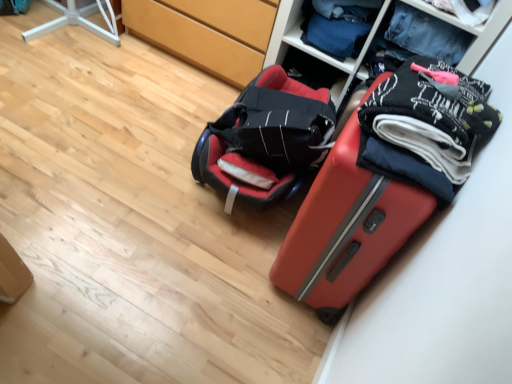
Question: Can you confirm if matte black bag at center is smaller than denim jeans at upper right, which ranks as the second clothing in bottom-to-top order?

Choices:
 (A) no
 (B) yes

Answer: (A)

Question: Is matte black bag at center positioned in front of denim jeans at upper right, which ranks as the second clothing in bottom-to-top order?

Choices:
 (A) no
 (B) yes

Answer: (B)

Question: From the image's perspective, is matte black bag at center below denim jeans at upper right, which ranks as the second clothing in bottom-to-top order?

Choices:
 (A) yes
 (B) no

Answer: (A)

Question: From a real-world perspective, is matte black bag at center over denim jeans at upper right, placed as the 1th clothing when sorted from back to front?

Choices:
 (A) yes
 (B) no

Answer: (B)

Question: Is matte black bag at center beside denim jeans at upper right, the second clothing in the front-to-back sequence?

Choices:
 (A) yes
 (B) no

Answer: (B)

Question: Considering the relative positions of matte black bag at center and denim jeans at upper right, placed as the 1th clothing when sorted from back to front, in the image provided, is matte black bag at center to the left of denim jeans at upper right, placed as the 1th clothing when sorted from back to front, from the viewer's perspective?

Choices:
 (A) no
 (B) yes

Answer: (B)

Question: Is denim jeans at upper right, the second clothing in the front-to-back sequence, positioned before matte wood cabinet at center?

Choices:
 (A) yes
 (B) no

Answer: (A)

Question: Is denim jeans at upper right, placed as the 1th clothing when sorted from back to front, outside matte wood cabinet at center?

Choices:
 (A) no
 (B) yes

Answer: (B)

Question: From a real-world perspective, is denim jeans at upper right, which ranks as the second clothing in bottom-to-top order, on top of matte wood cabinet at center?

Choices:
 (A) no
 (B) yes

Answer: (B)

Question: Is denim jeans at upper right, placed as the 1th clothing when sorted from back to front, far from matte wood cabinet at center?

Choices:
 (A) yes
 (B) no

Answer: (B)

Question: Is denim jeans at upper right, the second clothing in the front-to-back sequence, wider than matte wood cabinet at center?

Choices:
 (A) no
 (B) yes

Answer: (A)

Question: Can you confirm if denim jeans at upper right, which ranks as the second clothing in bottom-to-top order, is taller than matte wood cabinet at center?

Choices:
 (A) yes
 (B) no

Answer: (B)

Question: Is matte red suitcase at lower right wider than matte wood cabinet at center?

Choices:
 (A) no
 (B) yes

Answer: (A)